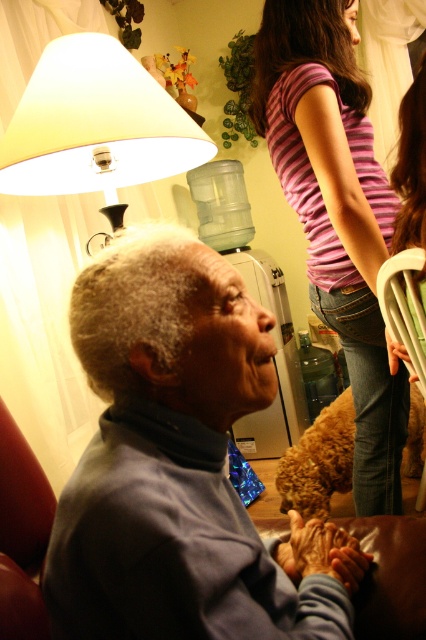
Between striped cotton shirt at upper right and white plastic chair at right, which one has less height?

Standing shorter between the two is white plastic chair at right.

Which is in front, point (354, 481) or point (389, 276)?

Point (389, 276)

The width and height of the screenshot is (426, 640). What do you see at coordinates (336, 211) in the screenshot?
I see `striped cotton shirt at upper right` at bounding box center [336, 211].

The height and width of the screenshot is (640, 426). Identify the location of striped cotton shirt at upper right. (336, 211).

Between gray fabric jacket at lower left and striped cotton shirt at upper right, which one has more height?

Standing taller between the two is striped cotton shirt at upper right.

Does gray fabric jacket at lower left appear over striped cotton shirt at upper right?

Incorrect, gray fabric jacket at lower left is not positioned above striped cotton shirt at upper right.

Where is `gray fabric jacket at lower left`? This screenshot has height=640, width=426. gray fabric jacket at lower left is located at coordinates (180, 465).

Does striped cotton shirt at upper right come in front of striped fabric shirt at upper center?

No, it is not.

Does striped cotton shirt at upper right have a lesser height compared to striped fabric shirt at upper center?

In fact, striped cotton shirt at upper right may be taller than striped fabric shirt at upper center.

Does point (327, 118) come in front of point (400, 173)?

That is False.

Locate an element on the screen. The image size is (426, 640). striped cotton shirt at upper right is located at coordinates (336, 211).